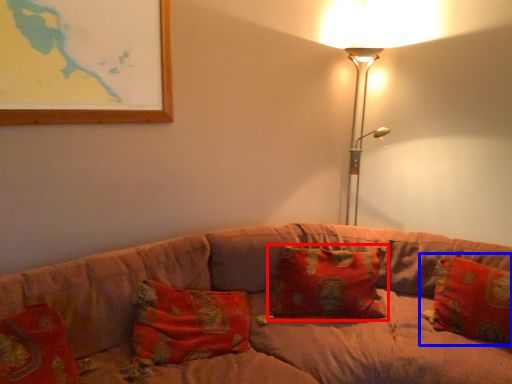
Question: Which point is closer to the camera, pillow (highlighted by a red box) or pillow (highlighted by a blue box)?

Choices:
 (A) pillow
 (B) pillow

Answer: (B)